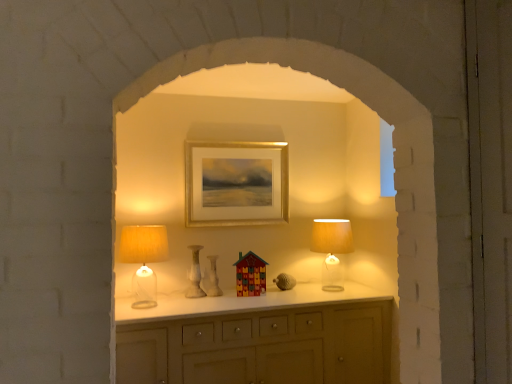
Identify the location of free space above gold metallic picture frame at center (from a real-world perspective). This screenshot has height=384, width=512. (239, 144).